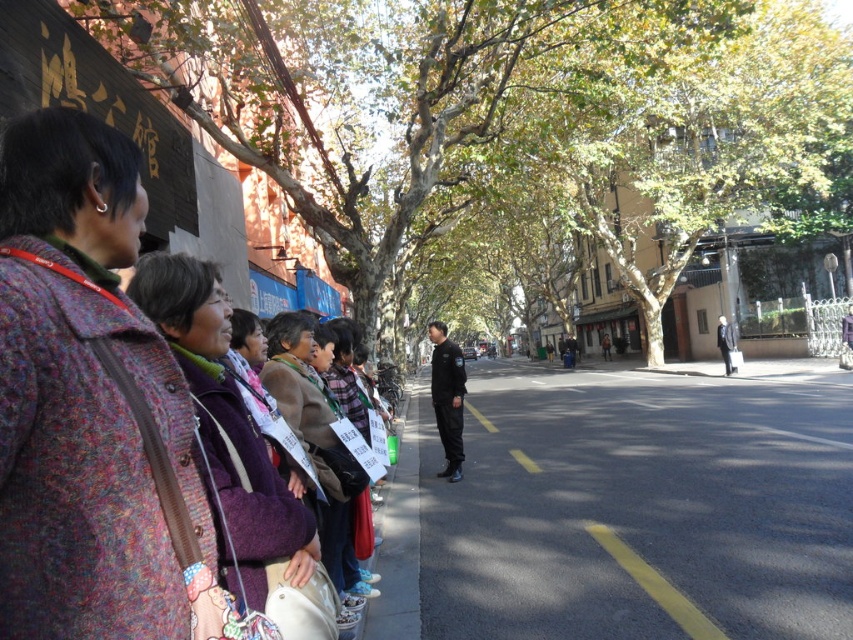
Is black asphalt pavement at center above dark gray jacket at center?

Incorrect, black asphalt pavement at center is not positioned above dark gray jacket at center.

This screenshot has width=853, height=640. Identify the location of black asphalt pavement at center. (640, 508).

Between black asphalt pavement at center and gray concrete curb at lower center, which one appears on the right side from the viewer's perspective?

black asphalt pavement at center is more to the right.

Which is in front, point (544, 432) or point (395, 593)?

Point (395, 593) is in front.

The width and height of the screenshot is (853, 640). Identify the location of black asphalt pavement at center. (640, 508).

Is point (367, 618) positioned in front of point (729, 324)?

Yes, point (367, 618) is closer to viewer.

Which of these two, gray concrete curb at lower center or dark gray jacket at center, stands taller?

dark gray jacket at center

Is point (376, 637) in front of point (728, 364)?

Yes, it is in front of point (728, 364).

The height and width of the screenshot is (640, 853). What are the coordinates of `gray concrete curb at lower center` in the screenshot? It's located at (398, 540).